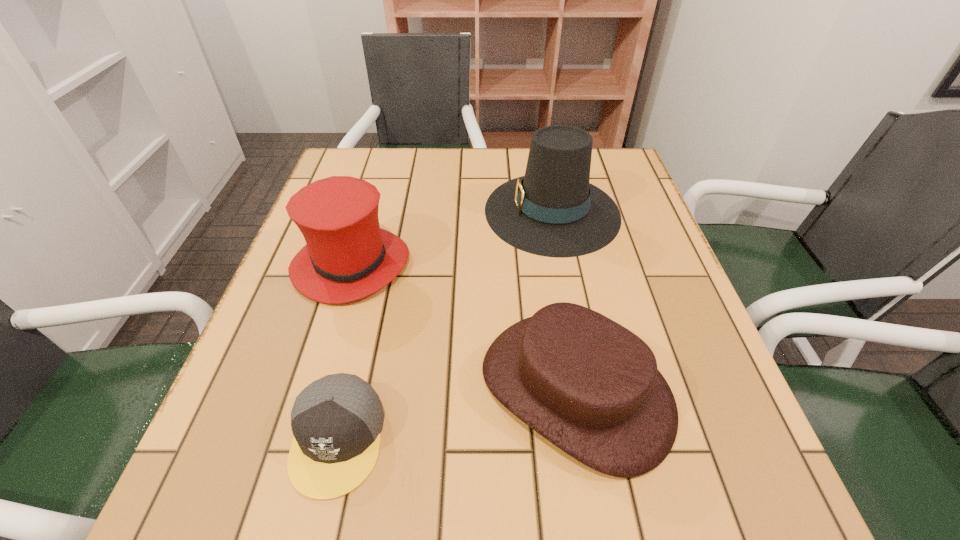
Find the location of a particular element. blank space at the left edge of the desktop is located at coordinates point(293,357).

In order to click on free location at the right edge in this screenshot , I will do `click(658, 369)`.

This screenshot has width=960, height=540. Find the location of `vacant space at the far left corner`. vacant space at the far left corner is located at coordinates (374, 184).

In order to click on free region at the far right corner in this screenshot , I will do `click(597, 156)`.

The height and width of the screenshot is (540, 960). What are the coordinates of `vacant area that lies between the tallest hat and the third shortest object` in the screenshot? It's located at (452, 238).

The width and height of the screenshot is (960, 540). Find the location of `free area in between the cap and the tallest hat`. free area in between the cap and the tallest hat is located at coordinates (444, 325).

Identify the location of vacant space in between the cap and the second tallest hat. (345, 352).

The height and width of the screenshot is (540, 960). In order to click on free spot between the shortest hat and the cap in this screenshot , I will do `click(456, 414)`.

This screenshot has width=960, height=540. In order to click on vacant area that lies between the tallest object and the shortest object in this screenshot , I will do 444,325.

The width and height of the screenshot is (960, 540). In order to click on free space between the shortest object and the nearest hat in this screenshot , I will do `click(456, 414)`.